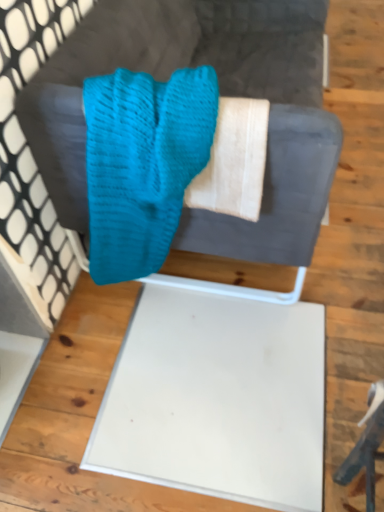
Question: Considering the relative sizes of teal knitted scrub at center and knitted teal sweater at upper center in the image provided, is teal knitted scrub at center wider than knitted teal sweater at upper center?

Choices:
 (A) yes
 (B) no

Answer: (B)

Question: Could you tell me if teal knitted scrub at center is turned towards knitted teal sweater at upper center?

Choices:
 (A) yes
 (B) no

Answer: (A)

Question: From a real-world perspective, is teal knitted scrub at center beneath knitted teal sweater at upper center?

Choices:
 (A) no
 (B) yes

Answer: (A)

Question: From the image's perspective, is teal knitted scrub at center over knitted teal sweater at upper center?

Choices:
 (A) no
 (B) yes

Answer: (A)

Question: Considering the relative sizes of teal knitted scrub at center and knitted teal sweater at upper center in the image provided, is teal knitted scrub at center taller than knitted teal sweater at upper center?

Choices:
 (A) no
 (B) yes

Answer: (A)

Question: Is teal knitted scrub at center facing away from knitted teal sweater at upper center?

Choices:
 (A) yes
 (B) no

Answer: (A)

Question: Is knitted teal sweater at upper center at the left side of teal knitted scrub at center?

Choices:
 (A) yes
 (B) no

Answer: (B)

Question: Is knitted teal sweater at upper center next to teal knitted scrub at center and touching it?

Choices:
 (A) yes
 (B) no

Answer: (B)

Question: Considering the relative sizes of knitted teal sweater at upper center and teal knitted scrub at center in the image provided, is knitted teal sweater at upper center shorter than teal knitted scrub at center?

Choices:
 (A) yes
 (B) no

Answer: (B)

Question: Does knitted teal sweater at upper center appear on the right side of teal knitted scrub at center?

Choices:
 (A) yes
 (B) no

Answer: (A)

Question: Considering the relative sizes of knitted teal sweater at upper center and teal knitted scrub at center in the image provided, is knitted teal sweater at upper center bigger than teal knitted scrub at center?

Choices:
 (A) no
 (B) yes

Answer: (B)

Question: From a real-world perspective, is knitted teal sweater at upper center on teal knitted scrub at center?

Choices:
 (A) yes
 (B) no

Answer: (B)

Question: From their relative heights in the image, would you say teal knitted scrub at center is taller or shorter than knitted teal sweater at upper center?

Choices:
 (A) tall
 (B) short

Answer: (B)